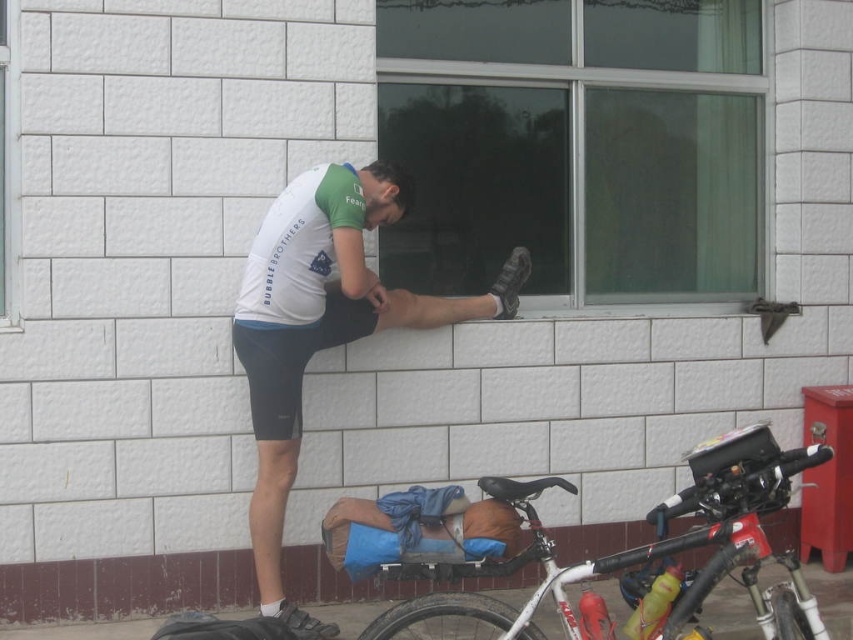
Question: Which of these objects is positioned farthest from the white matte shorts at center?

Choices:
 (A) white matte bicycle at lower center
 (B) black rubber tire at lower center

Answer: (A)

Question: Which point is closer to the camera?

Choices:
 (A) white matte shorts at center
 (B) white matte bicycle at lower center

Answer: (B)

Question: Does white matte shorts at center have a smaller size compared to white matte bicycle at lower center?

Choices:
 (A) yes
 (B) no

Answer: (B)

Question: Is white matte shorts at center below black rubber tire at lower center?

Choices:
 (A) yes
 (B) no

Answer: (B)

Question: Which object is positioned farthest from the white matte shorts at center?

Choices:
 (A) white matte bicycle at lower center
 (B) black rubber tire at lower center

Answer: (A)

Question: Is white matte shorts at center smaller than white matte bicycle at lower center?

Choices:
 (A) yes
 (B) no

Answer: (B)